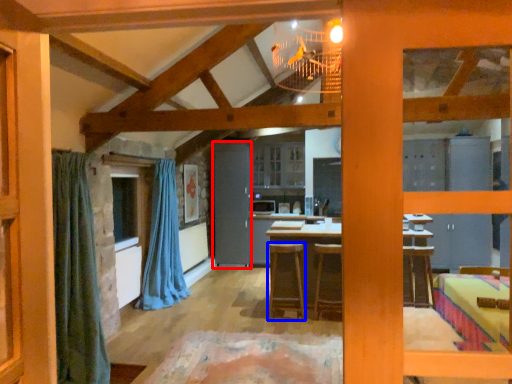
Question: Which point is further to the camera, barn door (highlighted by a red box) or stool (highlighted by a blue box)?

Choices:
 (A) barn door
 (B) stool

Answer: (A)